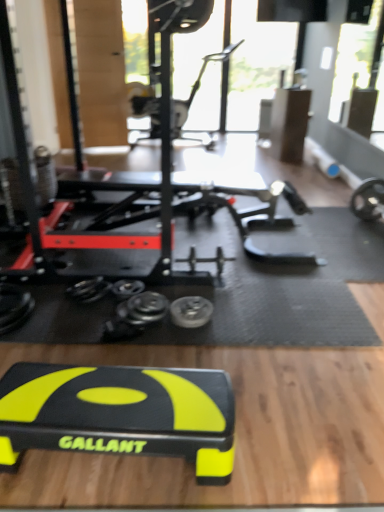
Question: From the image's perspective, would you say black rubber step platform at center, arranged as the 2th sport equipment when viewed from the top, is positioned over metallic silver weight at center?

Choices:
 (A) no
 (B) yes

Answer: (A)

Question: Considering the relative positions of black rubber step platform at center, arranged as the first sport equipment when viewed from the front, and metallic silver weight at center in the image provided, is black rubber step platform at center, arranged as the first sport equipment when viewed from the front, to the left of metallic silver weight at center from the viewer's perspective?

Choices:
 (A) yes
 (B) no

Answer: (A)

Question: Would you say metallic silver weight at center is part of black rubber step platform at center, the first sport equipment from the bottom,'s contents?

Choices:
 (A) yes
 (B) no

Answer: (B)

Question: From the image's perspective, would you say black rubber step platform at center, the first sport equipment from the bottom, is shown under metallic silver weight at center?

Choices:
 (A) no
 (B) yes

Answer: (B)

Question: Is black rubber step platform at center, arranged as the first sport equipment when viewed from the front, in contact with metallic silver weight at center?

Choices:
 (A) no
 (B) yes

Answer: (A)

Question: Considering the positions of point (198, 87) and point (205, 306), is point (198, 87) closer or farther from the camera than point (205, 306)?

Choices:
 (A) closer
 (B) farther

Answer: (B)

Question: From a real-world perspective, relative to metallic silver weight at center, is metallic silver exercise bike at upper center, marked as the 1th sport equipment in a top-to-bottom arrangement, vertically above or below?

Choices:
 (A) above
 (B) below

Answer: (A)

Question: From the image's perspective, is metallic silver exercise bike at upper center, which is the 2th sport equipment in bottom-to-top order, positioned above or below metallic silver weight at center?

Choices:
 (A) below
 (B) above

Answer: (B)

Question: Is metallic silver exercise bike at upper center, which is the 2th sport equipment in bottom-to-top order, in front of or behind metallic silver weight at center in the image?

Choices:
 (A) front
 (B) behind

Answer: (B)

Question: From the image's perspective, is metallic silver exercise bike at upper center, the 1th sport equipment positioned from the back, above or below black rubber step platform at center, arranged as the 2th sport equipment when viewed from the top?

Choices:
 (A) above
 (B) below

Answer: (A)

Question: Is metallic silver exercise bike at upper center, marked as the 1th sport equipment in a top-to-bottom arrangement, in front of or behind black rubber step platform at center, which is the second sport equipment in back-to-front order, in the image?

Choices:
 (A) front
 (B) behind

Answer: (B)

Question: Visually, is metallic silver exercise bike at upper center, marked as the 1th sport equipment in a top-to-bottom arrangement, positioned to the left or to the right of black rubber step platform at center, which is the second sport equipment in back-to-front order?

Choices:
 (A) left
 (B) right

Answer: (B)

Question: Is metallic silver exercise bike at upper center, the 1th sport equipment positioned from the back, wider or thinner than black rubber step platform at center, arranged as the 2th sport equipment when viewed from the top?

Choices:
 (A) thin
 (B) wide

Answer: (A)

Question: Looking at the image, does metallic silver weight at center seem bigger or smaller compared to metallic silver exercise bike at upper center, which is the 2th sport equipment in bottom-to-top order?

Choices:
 (A) small
 (B) big

Answer: (A)

Question: Based on their positions, is metallic silver weight at center located to the left or right of metallic silver exercise bike at upper center, which is counted as the 2th sport equipment, starting from the front?

Choices:
 (A) left
 (B) right

Answer: (A)